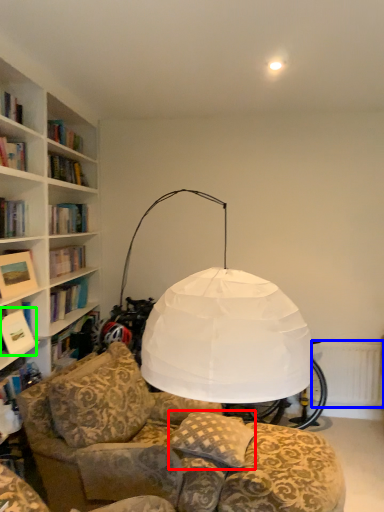
Question: Estimate the real-world distances between objects in this image. Which object is closer to pillow (highlighted by a red box), radiator (highlighted by a blue box) or book (highlighted by a green box)?

Choices:
 (A) radiator
 (B) book

Answer: (B)